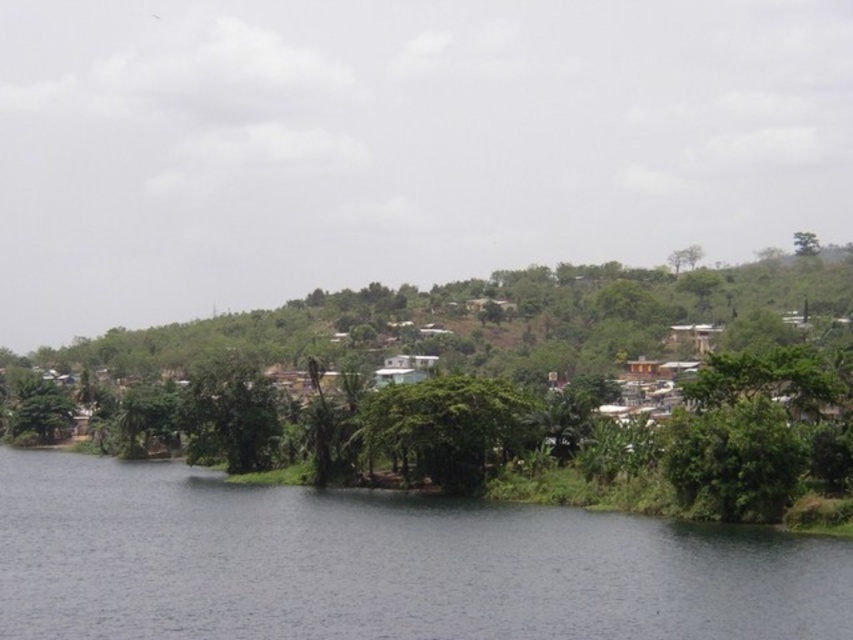
Is point (403, 404) positioned in front of point (817, 244)?

That is True.

Is point (436, 394) farther from viewer compared to point (802, 234)?

No, it is in front of (802, 234).

Which is in front, point (405, 440) or point (805, 232)?

Positioned in front is point (405, 440).

Identify the location of green leafy tree at center. (447, 428).

Is dark gray water at center smaller than green leafy tree at lower right?

No, dark gray water at center is not smaller than green leafy tree at lower right.

Is dark gray water at center bigger than green leafy tree at lower right?

Yes, dark gray water at center is bigger than green leafy tree at lower right.

Is point (751, 614) closer to viewer compared to point (782, 424)?

Yes, point (751, 614) is closer to viewer.

This screenshot has height=640, width=853. In order to click on dark gray water at center in this screenshot , I will do click(380, 564).

Between green leafy tree at lower right and green leafy tree at upper right, which one appears on the right side from the viewer's perspective?

green leafy tree at upper right is more to the right.

This screenshot has height=640, width=853. In order to click on green leafy tree at lower right in this screenshot , I will do `click(733, 460)`.